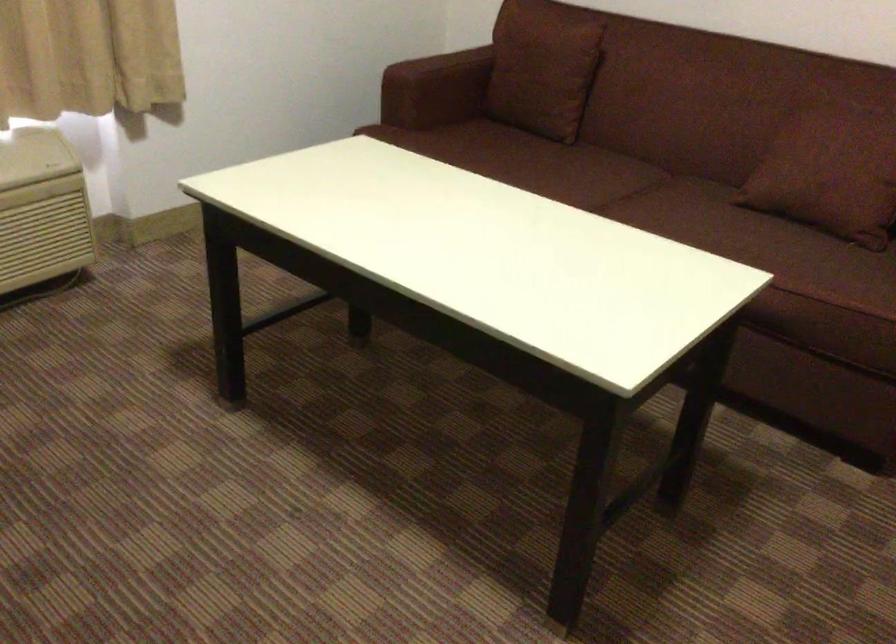
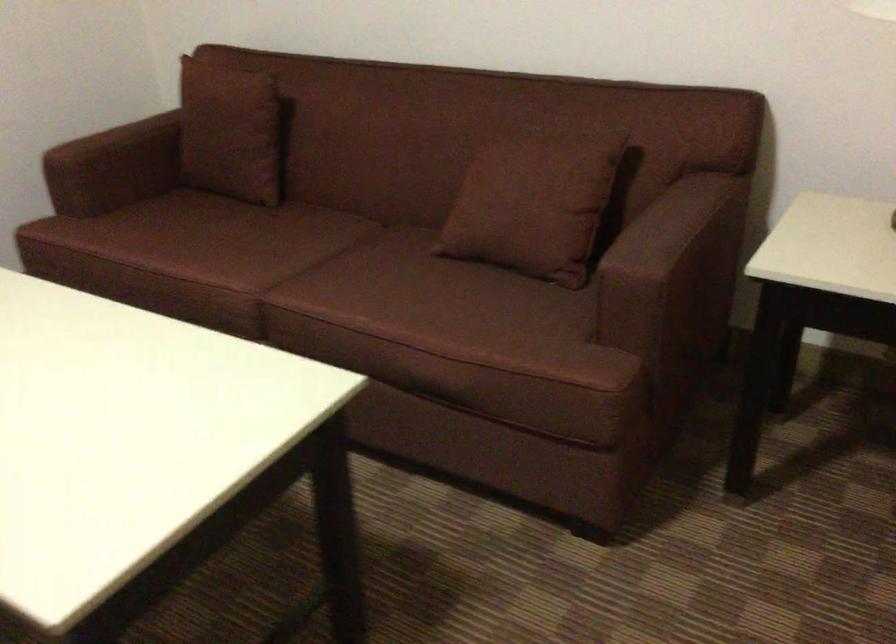
In a continuous first-person perspective shot, in which direction is the camera moving?

The cameraman walked toward right, forward.